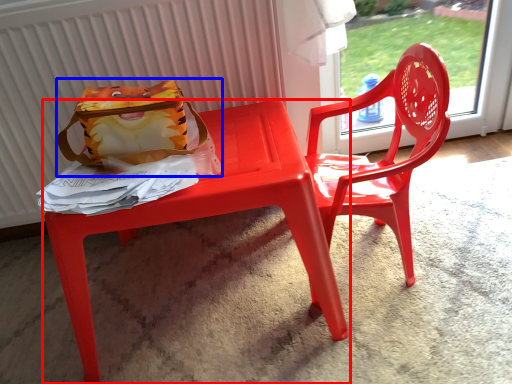
Question: Which point is further to the camera, table (highlighted by a red box) or pouch (highlighted by a blue box)?

Choices:
 (A) table
 (B) pouch

Answer: (B)